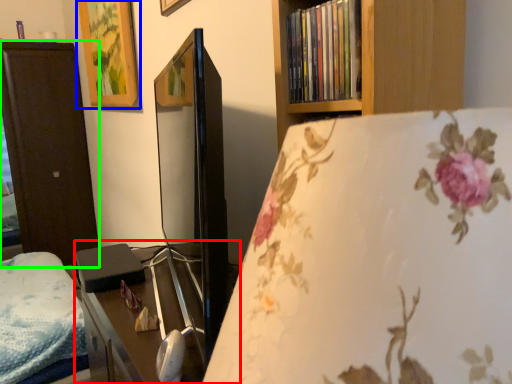
Question: Considering the real-world distances, which object is closest to table (highlighted by a red box)? picture frame (highlighted by a blue box) or furniture (highlighted by a green box).

Choices:
 (A) picture frame
 (B) furniture

Answer: (A)